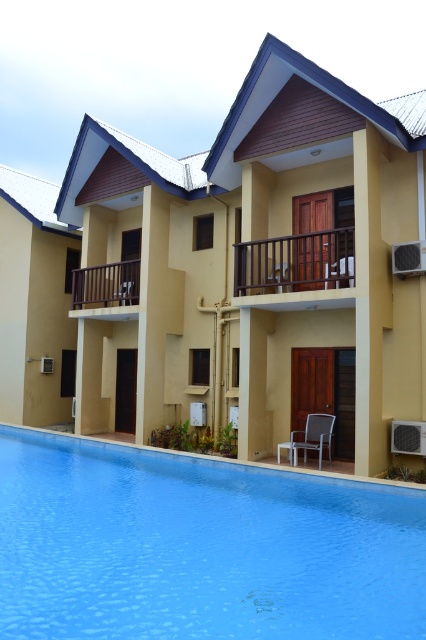
Question: Is yellow matte building at center positioned in front of brown wooden railing at upper center?

Choices:
 (A) no
 (B) yes

Answer: (B)

Question: Can you confirm if brown wooden railing at upper center is wider than metallic gray chair at lower center?

Choices:
 (A) no
 (B) yes

Answer: (B)

Question: Considering the real-world distances, which object is farthest from the brown wooden railing at upper left?

Choices:
 (A) metallic gray chair at lower center
 (B) brown wooden railing at upper center

Answer: (A)

Question: Which point is farther from the camera taking this photo?

Choices:
 (A) (316, 429)
 (B) (278, 232)
 (C) (120, 288)

Answer: (C)

Question: Which point is farther to the camera?

Choices:
 (A) (278, 387)
 (B) (287, 256)

Answer: (A)

Question: Can you confirm if yellow matte building at center is bigger than brown wooden railing at upper center?

Choices:
 (A) yes
 (B) no

Answer: (A)